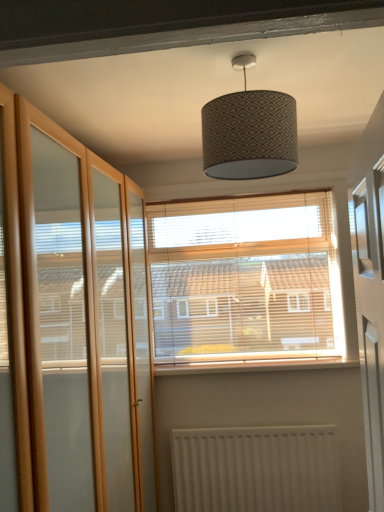
Image resolution: width=384 pixels, height=512 pixels. Describe the element at coordinates (256, 469) in the screenshot. I see `white textured radiator at lower center` at that location.

The image size is (384, 512). Describe the element at coordinates (245, 279) in the screenshot. I see `wooden blinds at center` at that location.

Where is `wooden blinds at center`? wooden blinds at center is located at coordinates (245, 279).

Locate an element on the screen. white painted wood at center is located at coordinates (253, 365).

You are a GUI agent. You are given a task and a screenshot of the screen. Output one action in this format:
    pyautogui.click(x=<x>, y=<y>)
    Task: Click on the white textured radiator at lower center
    
    Given the screenshot: What is the action you would take?
    pyautogui.click(x=256, y=469)

How many degrees apart are the facing directions of clear glass screen door at left and patterned fabric lampshade at center?

They differ by 88.7 degrees in their facing directions.

Is patterned fabric lampshade at center at the back of clear glass screen door at left?

No.

Which of these two, clear glass screen door at left or patterned fabric lampshade at center, is wider?

With larger width is patterned fabric lampshade at center.

Measure the distance between clear glass screen door at left and patterned fabric lampshade at center.

clear glass screen door at left and patterned fabric lampshade at center are 71.57 centimeters apart.

Which is more distant, (317, 470) or (233, 338)?

Positioned behind is point (233, 338).

Does white textured radiator at lower center touch wooden blinds at center?

white textured radiator at lower center and wooden blinds at center are clearly separated.

From a real-world perspective, which object stands above the other?

From a 3D spatial view, wooden blinds at center is above.

Identify the location of screen door in front of the wooden blinds at center. This screenshot has width=384, height=512. (78, 321).

Which object is further away from the camera, wooden blinds at center or clear glass screen door at left?

wooden blinds at center is further from the camera.

From the image's perspective, which is below, wooden blinds at center or clear glass screen door at left?

From the image's view, clear glass screen door at left is below.

Which object is positioned more to the right, wooden blinds at center or white textured radiator at lower center?

white textured radiator at lower center is more to the right.

Who is shorter, wooden blinds at center or white textured radiator at lower center?

white textured radiator at lower center is shorter.

Is wooden blinds at center facing away from white textured radiator at lower center?

No, wooden blinds at center is not facing away from white textured radiator at lower center.

How many degrees apart are the facing directions of wooden blinds at center and white textured radiator at lower center?

0.134 degrees separate the facing orientations of wooden blinds at center and white textured radiator at lower center.

Is clear glass screen door at left at the left side of white textured radiator at lower center?

Correct, you'll find clear glass screen door at left to the left of white textured radiator at lower center.

Is clear glass screen door at left positioned beyond the bounds of white textured radiator at lower center?

clear glass screen door at left lies outside white textured radiator at lower center's area.

Is clear glass screen door at left aimed at white textured radiator at lower center?

Yes, clear glass screen door at left is oriented towards white textured radiator at lower center.

Identify the location of radiator that appears below the clear glass screen door at left (from a real-world perspective). This screenshot has height=512, width=384. (256, 469).

Is patterned fabric lampshade at center positioned beyond the bounds of clear glass screen door at left?

patterned fabric lampshade at center lies outside clear glass screen door at left's area.

Which is in front, patterned fabric lampshade at center or clear glass screen door at left?

Positioned in front is clear glass screen door at left.

Considering the relative sizes of patterned fabric lampshade at center and clear glass screen door at left in the image provided, is patterned fabric lampshade at center taller than clear glass screen door at left?

No.

Could you tell me if patterned fabric lampshade at center is turned towards clear glass screen door at left?

No, patterned fabric lampshade at center is not facing towards clear glass screen door at left.

Is white textured radiator at lower center taller than clear glass screen door at left?

Incorrect, the height of white textured radiator at lower center is not larger of that of clear glass screen door at left.

Measure the distance between white textured radiator at lower center and clear glass screen door at left.

They are 3.31 feet apart.

In the image, is white textured radiator at lower center positioned in front of or behind clear glass screen door at left?

In the image, white textured radiator at lower center appears behind clear glass screen door at left.

Can you tell me how much white textured radiator at lower center and clear glass screen door at left differ in facing direction?

white textured radiator at lower center and clear glass screen door at left are facing 89.3 degrees away from each other.

Where is `lamp above the clear glass screen door at left (from the image's perspective)`? This screenshot has height=512, width=384. lamp above the clear glass screen door at left (from the image's perspective) is located at coordinates (249, 132).

Find the location of `radiator below the wooden blinds at center (from a real-world perspective)`. radiator below the wooden blinds at center (from a real-world perspective) is located at coordinates (256, 469).

From the image, which object appears to be nearer to white painted wood at center, white textured radiator at lower center or patterned fabric lampshade at center?

Among the two, white textured radiator at lower center is located nearer to white painted wood at center.

Consider the image. From the image, which object appears to be farther from wooden blinds at center, white textured radiator at lower center or white painted wood at center?

Based on the image, white textured radiator at lower center appears to be further to wooden blinds at center.

Estimate the real-world distances between objects in this image. Which object is further from white painted wood at center, patterned fabric lampshade at center or clear glass screen door at left?

patterned fabric lampshade at center lies further to white painted wood at center than the other object.

Estimate the real-world distances between objects in this image. Which object is further from white painted wood at center, white textured radiator at lower center or wooden blinds at center?

Based on the image, white textured radiator at lower center appears to be further to white painted wood at center.

Looking at the image, which one is located closer to white textured radiator at lower center, clear glass screen door at left or white painted wood at center?

white painted wood at center.

Looking at the image, which one is located closer to white textured radiator at lower center, clear glass screen door at left or patterned fabric lampshade at center?

clear glass screen door at left lies closer to white textured radiator at lower center than the other object.

Based on their spatial positions, is white textured radiator at lower center or clear glass screen door at left further from wooden blinds at center?

Based on the image, clear glass screen door at left appears to be further to wooden blinds at center.

Considering their positions, is wooden blinds at center positioned further to white painted wood at center than clear glass screen door at left?

clear glass screen door at left is further to white painted wood at center.

Identify the location of window sill between patterned fabric lampshade at center and white textured radiator at lower center in the vertical direction. (253, 365).

Image resolution: width=384 pixels, height=512 pixels. Identify the location of radiator positioned between clear glass screen door at left and white painted wood at center from near to far. (256, 469).

Identify the location of screen door between patterned fabric lampshade at center and white textured radiator at lower center in the up-down direction. (78, 321).

At what (x,y) coordinates should I click in order to perform the action: click on radiator between clear glass screen door at left and wooden blinds at center from front to back. Please return your answer as a coordinate pair (x, y). Image resolution: width=384 pixels, height=512 pixels. Looking at the image, I should click on (256, 469).